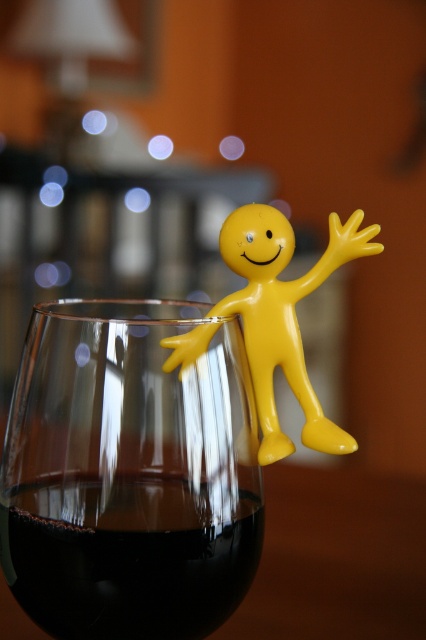
In the scene shown: You are at a dinner party and want to place your napkin on the table without touching the transparent glass at upper center or the yellow matte figure at upper right. Where should you place it?

The transparent glass at upper center is on the left side of the yellow matte figure at upper right, so placing the napkin to the right of the yellow matte figure at upper right or to the left of the transparent glass at upper center would avoid contact with both objects.

You are a bartender preparing a cocktail and need to place a garnish between the transparent glass at upper center and the yellow matte figure at upper right. The garnish requires 1.5 inches of space. Can you fit it there?

The distance between the transparent glass at upper center and the yellow matte figure at upper right is 1.70 inches, which is sufficient to accommodate the garnish requiring 1.5 inches of space.

You are a bartender preparing a drink and notice the transparent glass at upper center and the yellow matte figure at upper right. Which object is closer to you in the scene?

The transparent glass at upper center is closer to you because it is in front of the yellow matte figure at upper right.